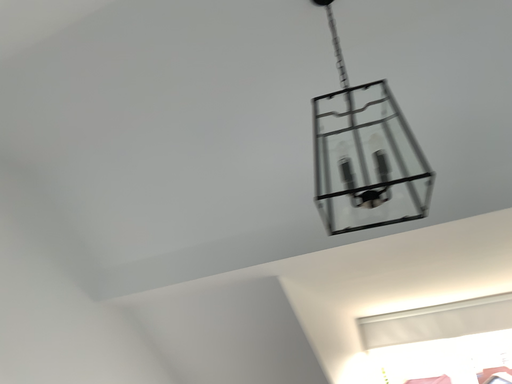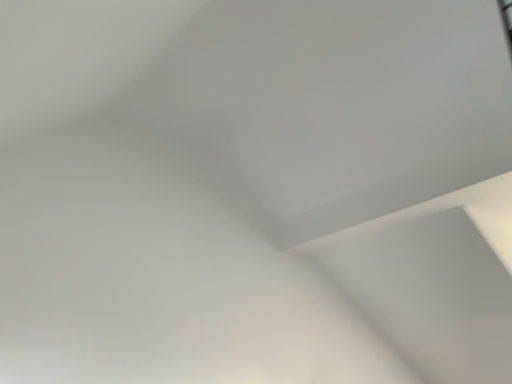
Question: How did the camera likely rotate when shooting the video?

Choices:
 (A) rotated right
 (B) rotated left

Answer: (B)